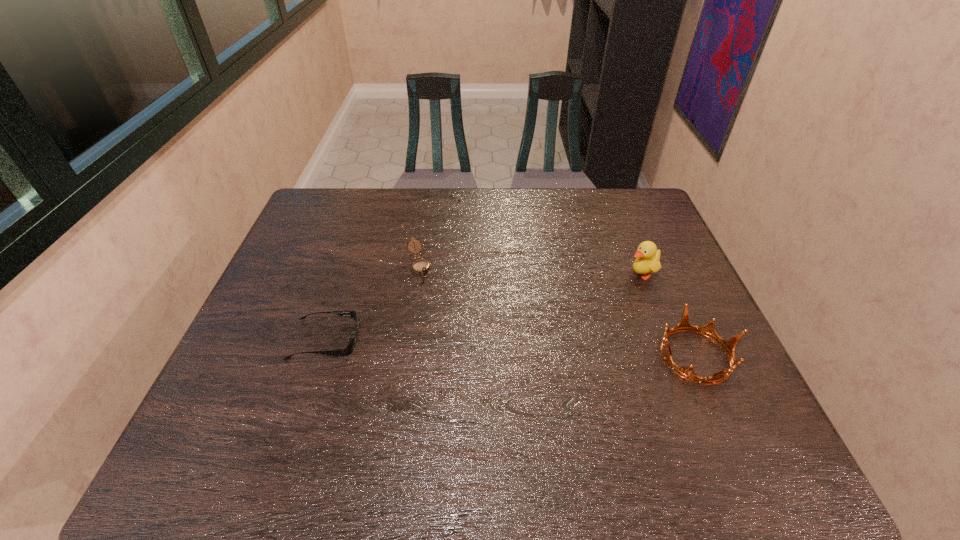
At what (x,y) coordinates should I click in order to perform the action: click on the shortest object. Please return your answer as a coordinate pair (x, y). The height and width of the screenshot is (540, 960). Looking at the image, I should click on (346, 351).

Locate an element on the screen. This screenshot has width=960, height=540. the leftmost object is located at coordinates (346, 351).

Locate an element on the screen. This screenshot has height=540, width=960. crown is located at coordinates (708, 330).

This screenshot has width=960, height=540. In order to click on the tallest object in this screenshot , I will do `click(647, 256)`.

In order to click on the third tallest object in this screenshot , I will do `click(420, 266)`.

Where is `compass`? The height and width of the screenshot is (540, 960). compass is located at coordinates (420, 266).

Identify the location of free location located 0.140m on the front-facing side of the shortest object. This screenshot has width=960, height=540. (416, 339).

You are a GUI agent. You are given a task and a screenshot of the screen. Output one action in this format:
    pyautogui.click(x=<x>, y=<y>)
    Task: Click on the free spot located 0.310m on the back of the third shortest object
    
    Given the screenshot: What is the action you would take?
    pyautogui.click(x=648, y=247)

You are a GUI agent. You are given a task and a screenshot of the screen. Output one action in this format:
    pyautogui.click(x=<x>, y=<y>)
    Task: Click on the free space located on the front-facing side of the tallest object
    
    Given the screenshot: What is the action you would take?
    pyautogui.click(x=612, y=285)

Where is `free space located on the front-facing side of the tallest object`? free space located on the front-facing side of the tallest object is located at coordinates (564, 308).